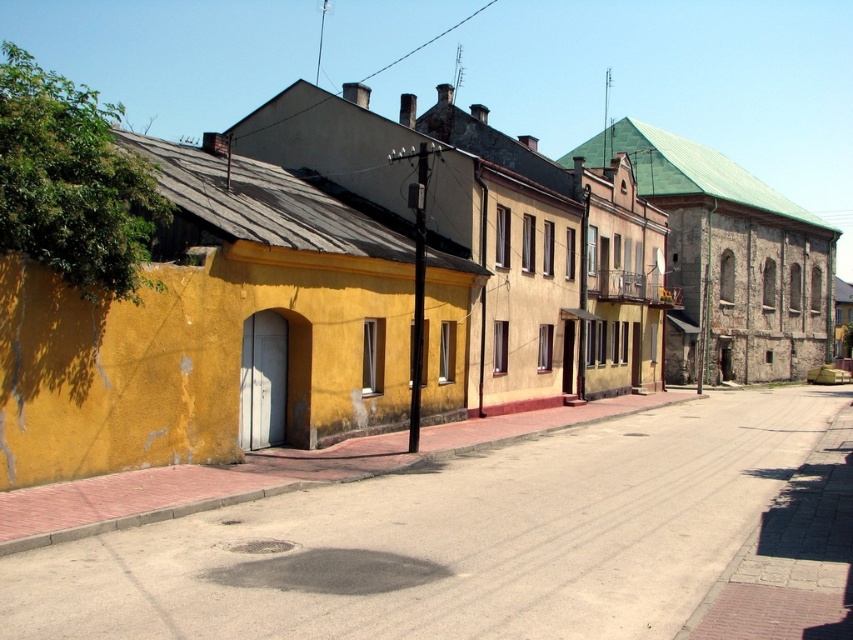
Between yellow matte building at left and smooth concrete alley at center, which one appears on the left side from the viewer's perspective?

smooth concrete alley at center

Is point (637, 230) in front of point (270, 577)?

That is False.

The height and width of the screenshot is (640, 853). Find the location of `yellow matte building at left`. yellow matte building at left is located at coordinates (402, 289).

Where is `yellow matte building at left`? yellow matte building at left is located at coordinates (402, 289).